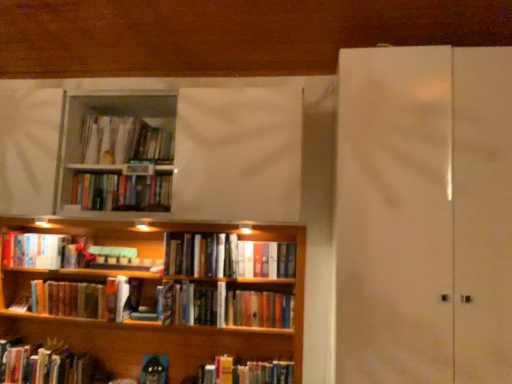
Question: From a real-world perspective, is hardcover book at left, positioned as the fifth book in bottom-to-top order, above or below white glossy screen door at right?

Choices:
 (A) above
 (B) below

Answer: (B)

Question: Based on their sizes in the image, would you say hardcover book at left, positioned as the third book in top-to-bottom order, is bigger or smaller than white glossy screen door at right?

Choices:
 (A) small
 (B) big

Answer: (A)

Question: Estimate the real-world distances between objects in this image. Which object is closer to the hardcover books at center, positioned as the sixth book in bottom-to-top order?

Choices:
 (A) hardcover books at lower left, which ranks as the seventh book in top-to-bottom order
 (B) hardcover book at lower left, which ranks as the 6th book in top-to-bottom order
 (C) hardcover books at upper center, the seventh book from the bottom
 (D) wooden bookcase at lower left
 (E) hardcover book at left, positioned as the third book in top-to-bottom order

Answer: (C)

Question: Which object is the closest to the hardcover books at center, positioned as the 3th book in bottom-to-top order?

Choices:
 (A) hardcover books at upper center, the seventh book from the bottom
 (B) hardcover books at lower left, which ranks as the seventh book in top-to-bottom order
 (C) white glossy screen door at right
 (D) wooden bookcase at lower left
 (E) hardcover book at lower left, which is the second book in bottom-to-top order

Answer: (D)